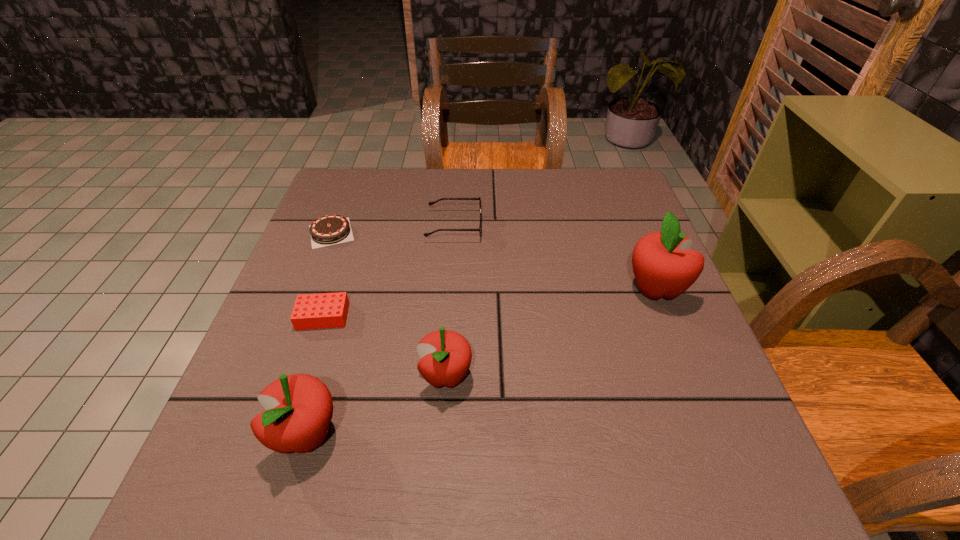
Find the location of `object present at the near left corner`. object present at the near left corner is located at coordinates (299, 408).

The width and height of the screenshot is (960, 540). What are the coordinates of `free location at the far edge` in the screenshot? It's located at (464, 180).

I want to click on free space at the near edge, so click(x=635, y=416).

In order to click on free space at the left edge in this screenshot , I will do `click(335, 255)`.

Where is `free space at the right edge of the desktop`? This screenshot has width=960, height=540. free space at the right edge of the desktop is located at coordinates (600, 224).

Locate an element on the screen. Image resolution: width=960 pixels, height=540 pixels. free space at the far left corner of the desktop is located at coordinates (334, 179).

Image resolution: width=960 pixels, height=540 pixels. In order to click on vacant area at the far right corner in this screenshot , I will do `click(576, 174)`.

Identify the location of free space between the second apple from left to right and the sunglasses. The image size is (960, 540). (450, 301).

Where is `free space that is in between the chocolate cake and the fifth shortest object`? The height and width of the screenshot is (540, 960). free space that is in between the chocolate cake and the fifth shortest object is located at coordinates (319, 334).

Where is `free spot between the second tallest apple and the third tallest object`? free spot between the second tallest apple and the third tallest object is located at coordinates (376, 406).